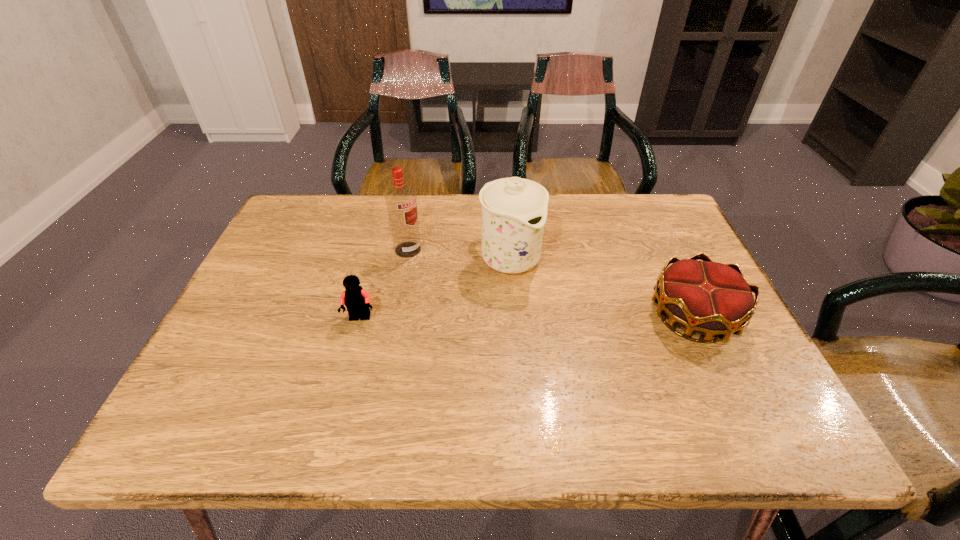
Identify which object is the nearest to the leftmost object. Please provide its 2D coordinates. Your answer should be formatted as a tuple, i.e. [(x, y)], where the tuple contains the x and y coordinates of a point satisfying the conditions above.

[(401, 202)]

Point out which object is positioned as the nearest to the third object from left to right. Please provide its 2D coordinates. Your answer should be formatted as a tuple, i.e. [(x, y)], where the tuple contains the x and y coordinates of a point satisfying the conditions above.

[(401, 202)]

Where is `vacant region that satisfies the following two spatial constraints: 1. on the front side of the crown; 2. on the right side of the vodka`? vacant region that satisfies the following two spatial constraints: 1. on the front side of the crown; 2. on the right side of the vodka is located at coordinates (396, 316).